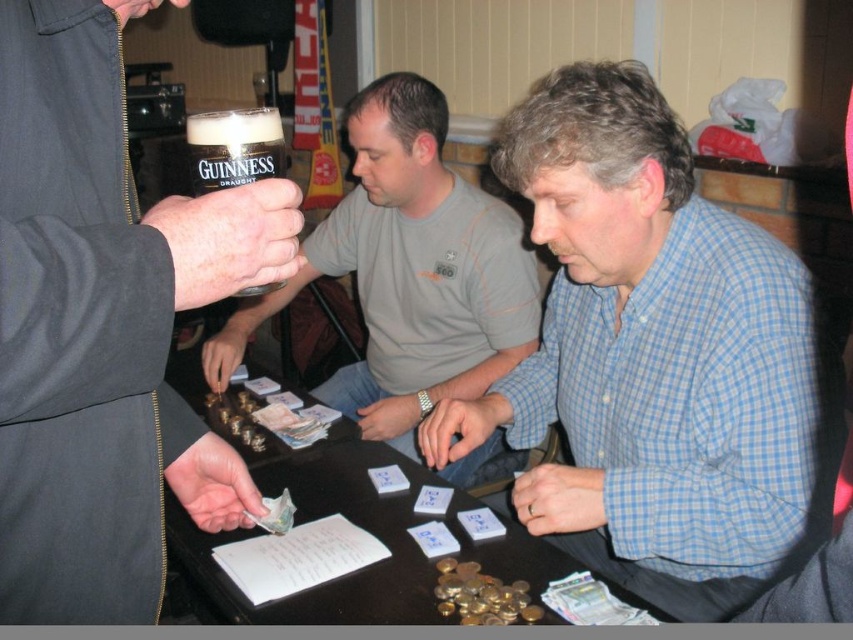
Which is above, matte black glass at left or guinness glass at upper left?

guinness glass at upper left

Is point (103, 570) farther from viewer compared to point (267, 113)?

No.

Locate an element on the screen. The image size is (853, 640). matte black glass at left is located at coordinates (103, 326).

Who is more distant from viewer, [421,128] or [334,602]?

Point [421,128]

Is matte black glass at center shorter than wooden table at center?

Incorrect, matte black glass at center's height does not fall short of wooden table at center's.

Measure the distance between matte black glass at center and camera.

The distance of matte black glass at center from camera is 1.64 meters.

The width and height of the screenshot is (853, 640). Find the location of `matte black glass at center`. matte black glass at center is located at coordinates (x=408, y=273).

Which of these two, matte black glass at left or wooden table at center, stands taller?

Standing taller between the two is matte black glass at left.

The height and width of the screenshot is (640, 853). Identify the location of matte black glass at left. (103, 326).